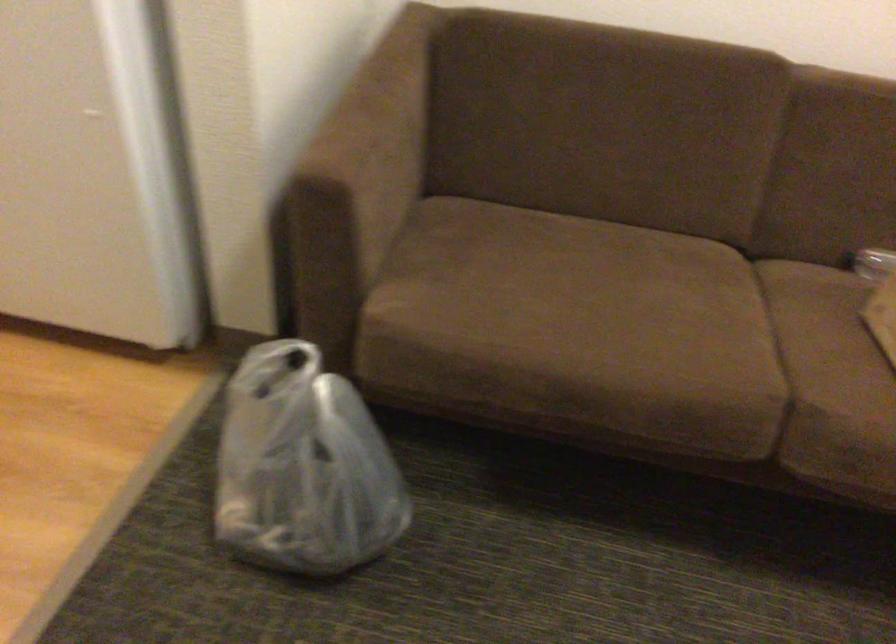
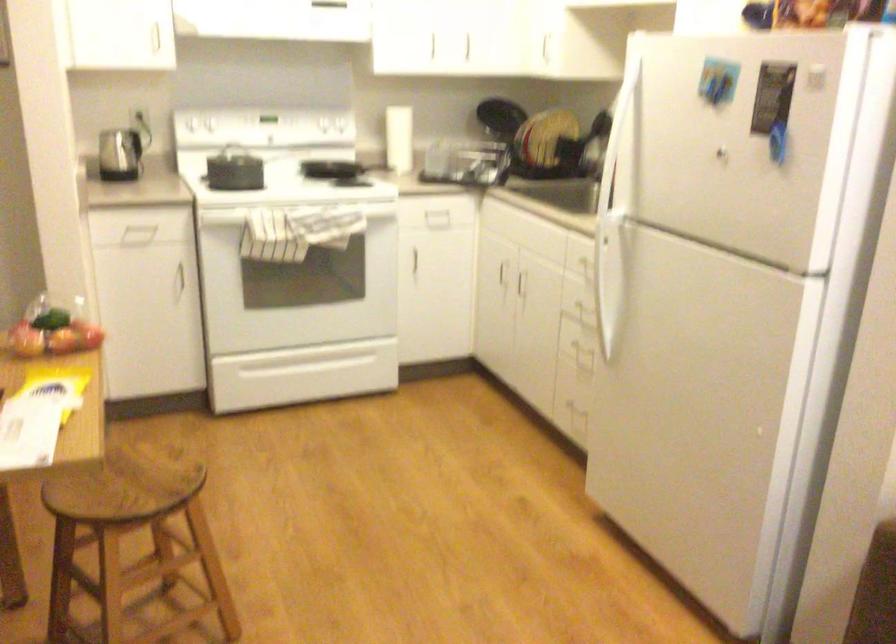
Question: How did the camera likely rotate?

Choices:
 (A) Left
 (B) Right
 (C) Up
 (D) Down

Answer: (A)